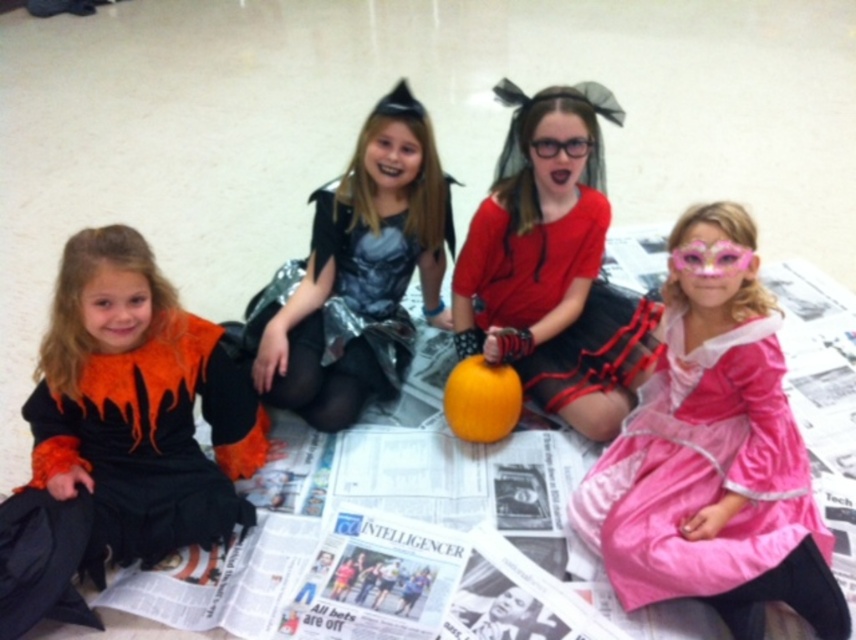
Which object is located at the coordinates point (131, 467)?

The orange matte black fabric dress at left is located at point (131, 467).